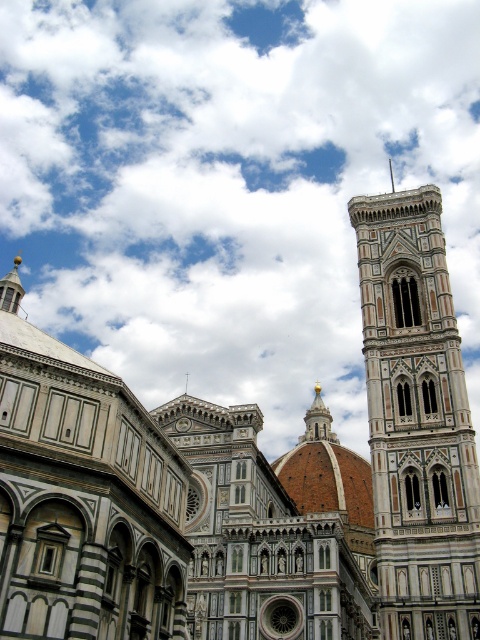
Question: Is white fluffy cloud at upper center below white marble bell tower at right?

Choices:
 (A) no
 (B) yes

Answer: (A)

Question: Is white fluffy cloud at upper center above white marble bell tower at right?

Choices:
 (A) no
 (B) yes

Answer: (B)

Question: Which point appears closest to the camera in this image?

Choices:
 (A) (215, 300)
 (B) (365, 326)

Answer: (B)

Question: Can you confirm if white fluffy cloud at upper center is smaller than white marble bell tower at right?

Choices:
 (A) no
 (B) yes

Answer: (A)

Question: Which point is closer to the camera?

Choices:
 (A) white marble bell tower at right
 (B) white fluffy cloud at upper center

Answer: (A)

Question: Which object appears closest to the camera in this image?

Choices:
 (A) white marble bell tower at right
 (B) white fluffy cloud at upper center

Answer: (A)